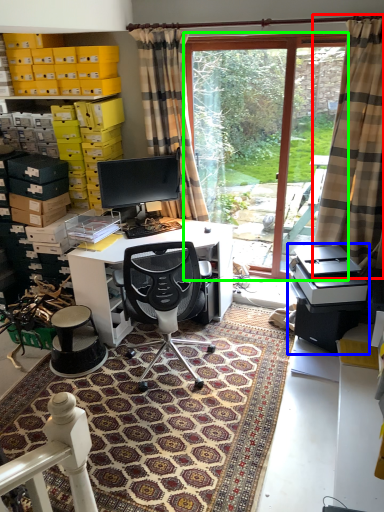
Question: Which object is the farthest from curtain (highlighted by a red box)? Choose among these: printer (highlighted by a blue box) or glass door (highlighted by a green box).

Choices:
 (A) printer
 (B) glass door

Answer: (B)